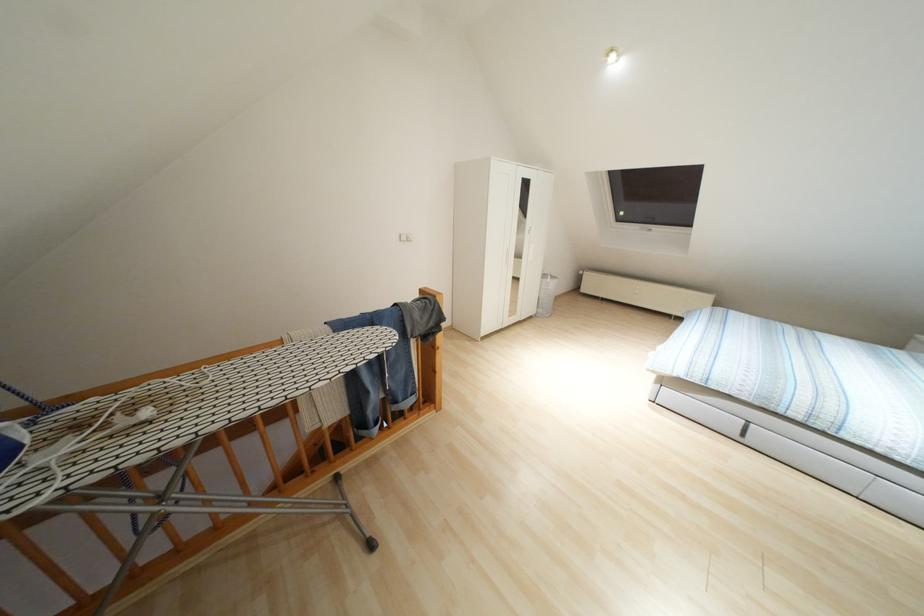
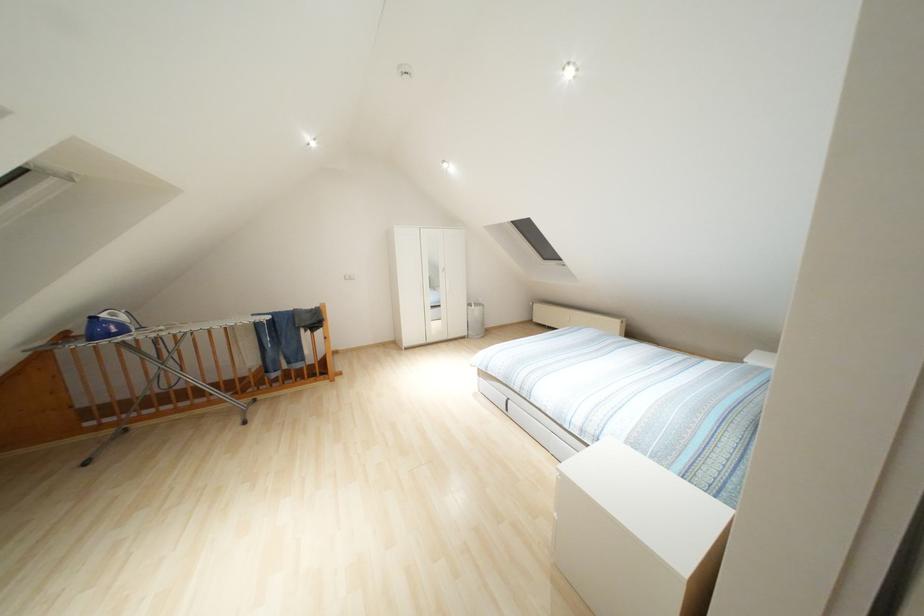
Question: In a continuous first-person perspective shot, in which direction is the camera moving?

Choices:
 (A) Left
 (B) Right
 (C) Forward
 (D) Backward

Answer: (B)